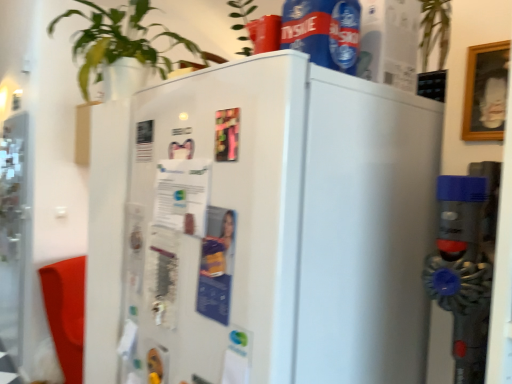
Question: In the image, is transparent glass screen door at left on the left side or the right side of white glossy refrigerator at center?

Choices:
 (A) right
 (B) left

Answer: (B)

Question: Considering the positions of transparent glass screen door at left and white glossy refrigerator at center in the image, is transparent glass screen door at left wider or thinner than white glossy refrigerator at center?

Choices:
 (A) thin
 (B) wide

Answer: (A)

Question: Considering the real-world distances, which object is farthest from the transparent glass screen door at left?

Choices:
 (A) green leafy plant at upper left
 (B) white glossy refrigerator at center
 (C) blue plastic bottle at upper center

Answer: (C)

Question: Which of these objects is positioned closest to the transparent glass screen door at left?

Choices:
 (A) white glossy refrigerator at center
 (B) green leafy plant at upper left
 (C) blue plastic bottle at upper center

Answer: (B)